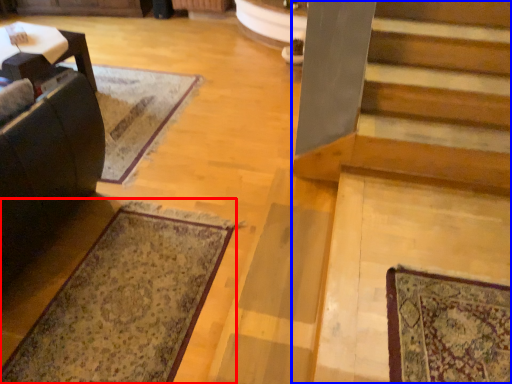
Question: Which object appears closest to the camera in this image, mat (highlighted by a red box) or stairs (highlighted by a blue box)?

Choices:
 (A) mat
 (B) stairs

Answer: (B)